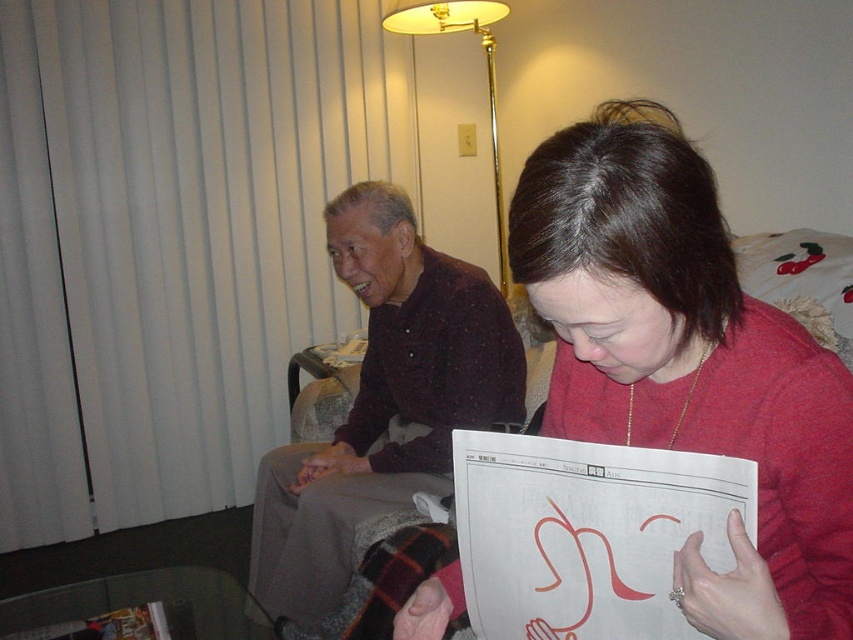
You are standing in the room and want to place a new decorative item between the dark brown sweater at center and the gold metallic floor lamp at upper center. Based on their positions, which object should the decorative item be closer to?

The dark brown sweater at center is to the left of gold metallic floor lamp at upper center, so the decorative item should be placed closer to the gold metallic floor lamp at upper center since it is on the right side.

You are an interior designer assessing the room layout. Considering the height of the matte red sweater at center and the gold metallic floor lamp at upper center, which object would you say is taller?

The gold metallic floor lamp at upper center is taller than the matte red sweater at center.